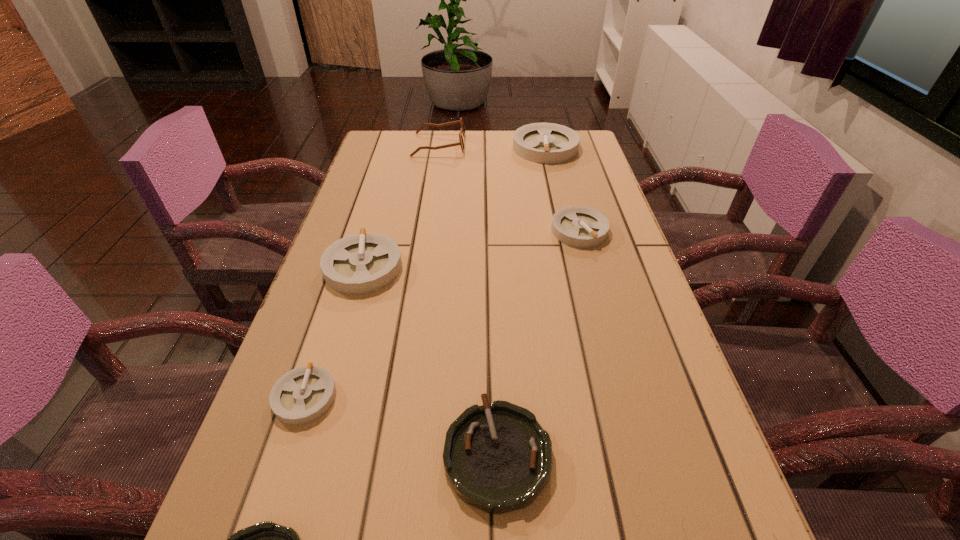
The width and height of the screenshot is (960, 540). I want to click on ashtray that stands as the sixth closest to the spectacles, so click(266, 539).

Identify the location of ashtray that is the closest to the biggest gray ashtray. (578, 226).

Where is `gray ashtray that stands as the third closest to the third biggest gray ashtray`? gray ashtray that stands as the third closest to the third biggest gray ashtray is located at coordinates (302, 395).

This screenshot has width=960, height=540. I want to click on gray ashtray that stands as the second closest to the sixth shortest object, so click(x=361, y=263).

Identify the location of green ashtray object that ranks as the closest to the fourth shortest ashtray. (497, 457).

Image resolution: width=960 pixels, height=540 pixels. Identify the location of free point that satisfies the following two spatial constraints: 1. on the front-facing side of the spectacles; 2. on the back side of the third biggest gray ashtray. (426, 230).

Find the location of `vacant space that satisfies the following two spatial constraints: 1. on the front-facing side of the spectacles; 2. on the right side of the tallest ashtray`. vacant space that satisfies the following two spatial constraints: 1. on the front-facing side of the spectacles; 2. on the right side of the tallest ashtray is located at coordinates (439, 148).

Identify the location of free space that satisfies the following two spatial constraints: 1. on the front-facing side of the tallest ashtray; 2. on the left side of the spectacles. (439, 148).